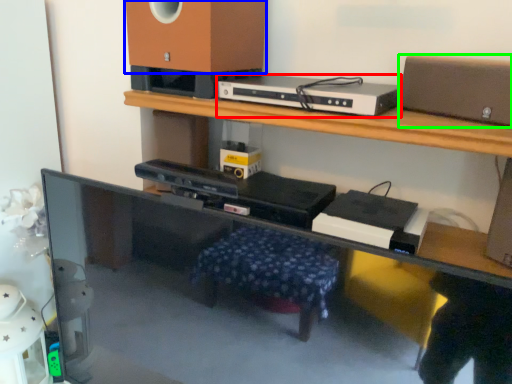
Question: Considering the real-world distances, which object is closest to gadget (highlighted by a red box)? speaker (highlighted by a blue box) or speaker (highlighted by a green box).

Choices:
 (A) speaker
 (B) speaker

Answer: (A)